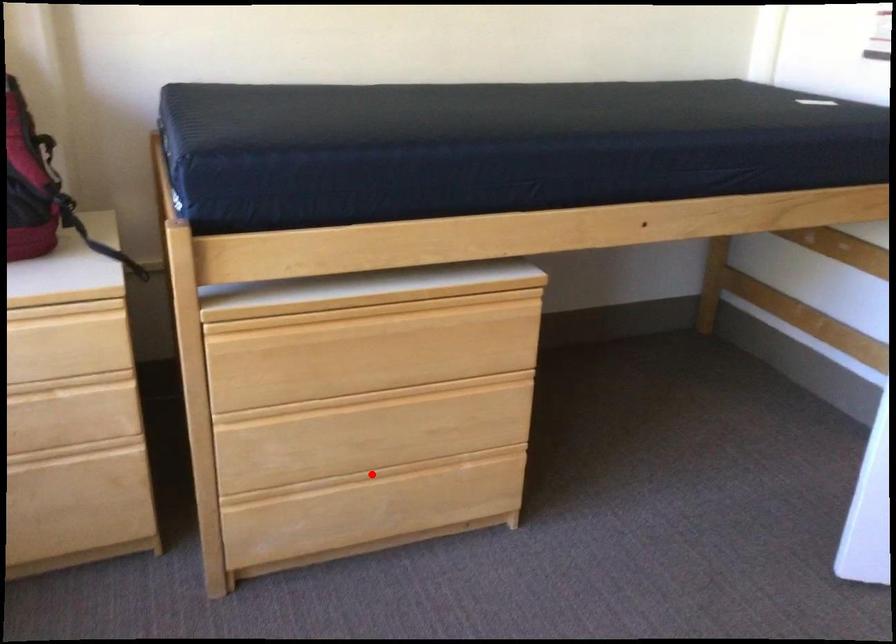
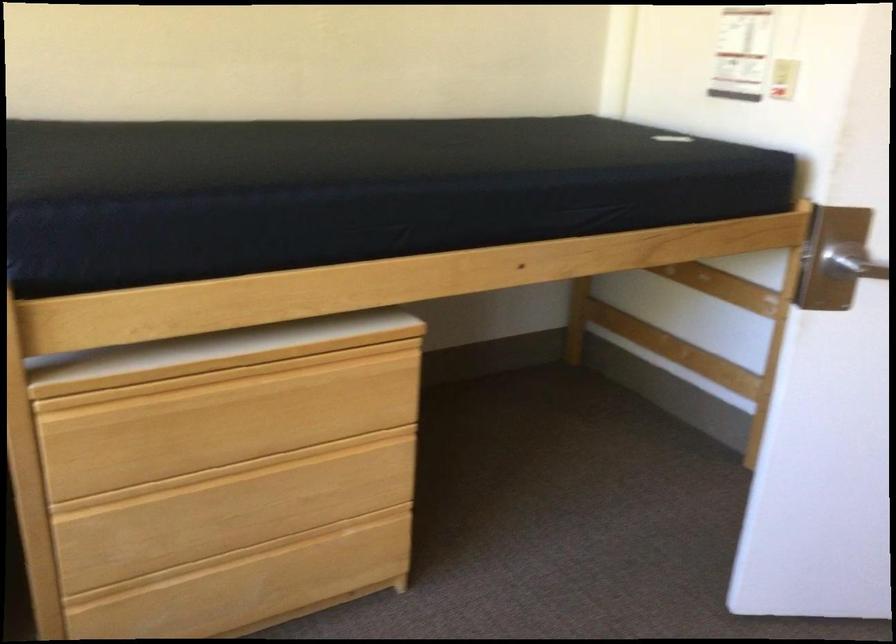
Question: I am providing you with two images of the same scene from different viewpoints. A red point is shown in image1. For the corresponding object point in image2, is it positioned nearer or farther from the camera?

Choices:
 (A) Nearer
 (B) Farther

Answer: (A)